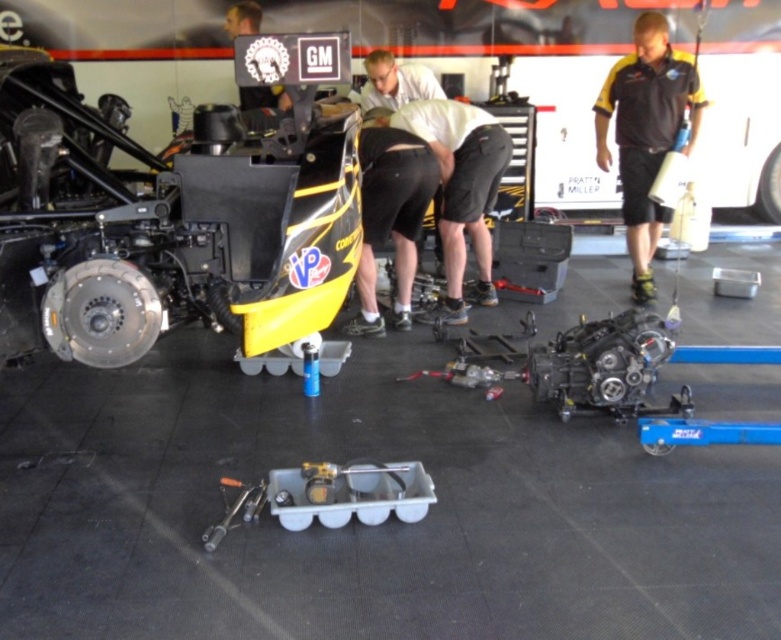
You are a mechanic working on the vehicle in the workshop. You need to reach the shiny metallic engine at center to inspect it. Is the metallic silver wrench at lower center blocking your path to the engine?

The metallic silver wrench at lower center is behind the shiny metallic engine at center, so it is not blocking your path to the engine. You can access the engine without moving the wrench.

You are a mechanic who needs to access the shiny metallic engine at center and the metallic silver wrench at lower center. Based on their positions, which object is closer to the ground?

The metallic silver wrench at lower center is closer to the ground because it is positioned below the shiny metallic engine at center.